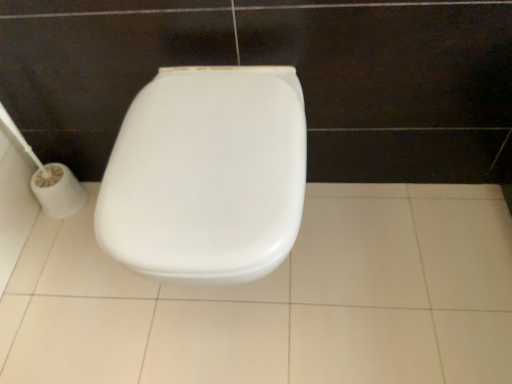
Question: Does white glossy tile at center have a lesser width compared to white plastic toilet paper at left?

Choices:
 (A) yes
 (B) no

Answer: (B)

Question: Considering the relative positions of white glossy tile at center and white plastic toilet paper at left in the image provided, is white glossy tile at center to the left of white plastic toilet paper at left from the viewer's perspective?

Choices:
 (A) no
 (B) yes

Answer: (A)

Question: Is white glossy tile at center in contact with white plastic toilet paper at left?

Choices:
 (A) no
 (B) yes

Answer: (A)

Question: Does white glossy tile at center turn towards white plastic toilet paper at left?

Choices:
 (A) no
 (B) yes

Answer: (A)

Question: From a real-world perspective, does white glossy tile at center sit lower than white plastic toilet paper at left?

Choices:
 (A) no
 (B) yes

Answer: (B)

Question: Does point (64, 193) appear closer or farther from the camera than point (52, 309)?

Choices:
 (A) closer
 (B) farther

Answer: (B)

Question: From the image's perspective, is white plastic toilet paper at left positioned above or below white glossy tile at center?

Choices:
 (A) above
 (B) below

Answer: (A)

Question: Is white plastic toilet paper at left situated inside white glossy tile at center or outside?

Choices:
 (A) inside
 (B) outside

Answer: (B)

Question: Considering the positions of white plastic toilet paper at left and white glossy tile at center in the image, is white plastic toilet paper at left taller or shorter than white glossy tile at center?

Choices:
 (A) short
 (B) tall

Answer: (B)

Question: In terms of width, does white glossy tile at center look wider or thinner when compared to white plastic toilet at center?

Choices:
 (A) thin
 (B) wide

Answer: (B)

Question: From a real-world perspective, is white glossy tile at center positioned above or below white plastic toilet at center?

Choices:
 (A) above
 (B) below

Answer: (B)

Question: Considering the positions of point (421, 284) and point (129, 109), is point (421, 284) closer or farther from the camera than point (129, 109)?

Choices:
 (A) closer
 (B) farther

Answer: (A)

Question: Relative to white plastic toilet at center, is white glossy tile at center in front or behind?

Choices:
 (A) behind
 (B) front

Answer: (A)

Question: Which is correct: white plastic toilet at center is inside white plastic toilet paper at left, or outside of it?

Choices:
 (A) outside
 (B) inside

Answer: (A)

Question: Considering the positions of white plastic toilet at center and white plastic toilet paper at left in the image, is white plastic toilet at center taller or shorter than white plastic toilet paper at left?

Choices:
 (A) short
 (B) tall

Answer: (A)